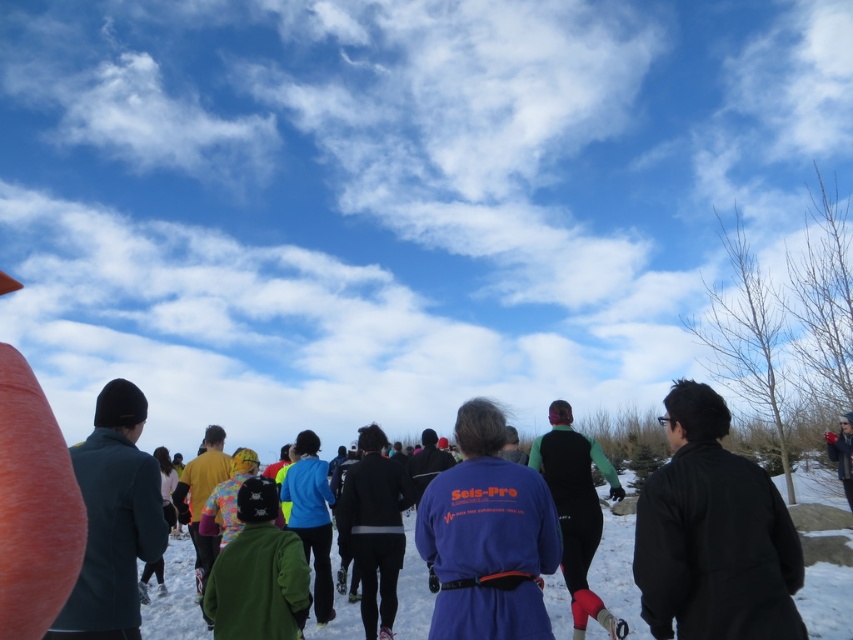
Question: In this image, where is black matte jacket at right located relative to blue fleece jacket at center?

Choices:
 (A) above
 (B) below

Answer: (A)

Question: Does black matte jacket at right appear on the right side of white powdery snow at center?

Choices:
 (A) yes
 (B) no

Answer: (B)

Question: Which point is closer to the camera taking this photo?

Choices:
 (A) (634, 611)
 (B) (764, 593)

Answer: (B)

Question: Is blue fleece jacket at center above white powdery snow at center?

Choices:
 (A) no
 (B) yes

Answer: (B)

Question: Considering the real-world distances, which object is farthest from the white powdery snow at center?

Choices:
 (A) blue fleece jacket at center
 (B) black matte jacket at right

Answer: (B)

Question: Which point is closer to the camera?

Choices:
 (A) blue fleece jacket at center
 (B) white powdery snow at center

Answer: (B)